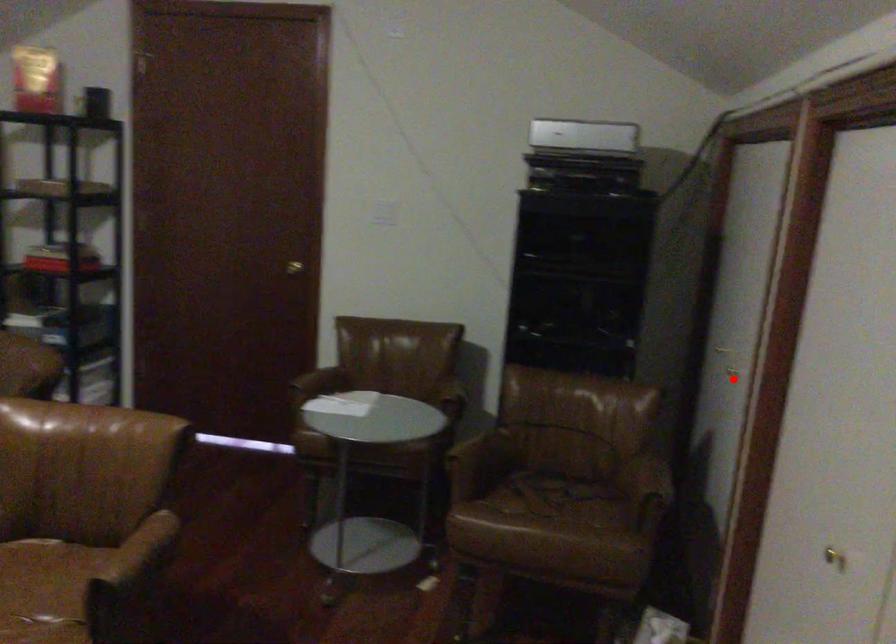
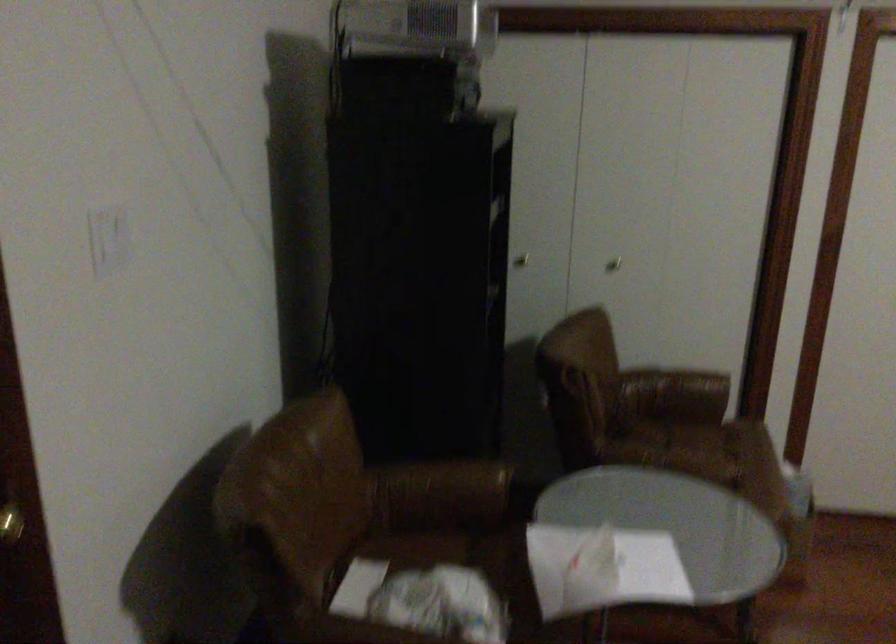
Where in the second image is the point corresponding to the highlighted location from the first image?

(613, 263)